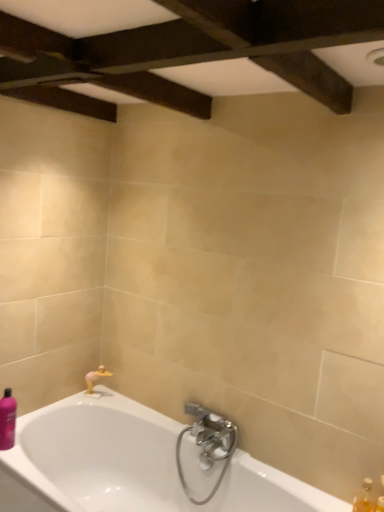
This screenshot has height=512, width=384. I want to click on blank area to the left of translucent amber bottle at lower right, so click(323, 500).